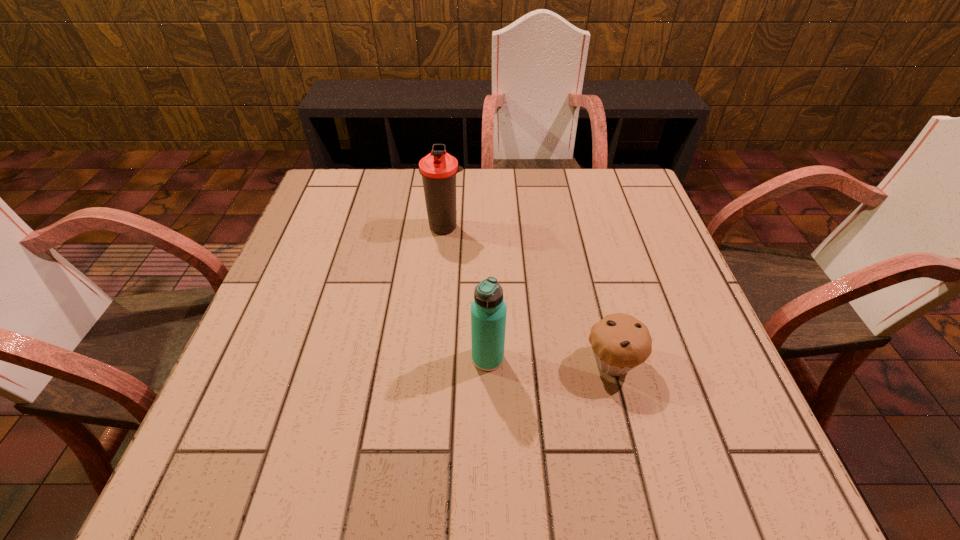
This screenshot has height=540, width=960. I want to click on object located at the right edge, so click(620, 342).

Identify the location of vacant space at the far edge. (529, 192).

Find the location of a particular element. Image resolution: width=960 pixels, height=540 pixels. free region at the near edge of the desktop is located at coordinates (586, 480).

Where is `vacant space at the left edge of the desktop`? This screenshot has width=960, height=540. vacant space at the left edge of the desktop is located at coordinates (312, 374).

Image resolution: width=960 pixels, height=540 pixels. In order to click on vacant area at the right edge of the desktop in this screenshot , I will do `click(638, 274)`.

The height and width of the screenshot is (540, 960). In order to click on vacant space at the far left corner in this screenshot , I will do `click(370, 200)`.

Where is `free space at the far right corner of the desktop`? free space at the far right corner of the desktop is located at coordinates (604, 174).

This screenshot has width=960, height=540. Find the location of `unoccupied area between the left thermos bottle and the rightmost object`. unoccupied area between the left thermos bottle and the rightmost object is located at coordinates (529, 294).

The image size is (960, 540). I want to click on free spot between the farther thermos bottle and the second object from left to right, so click(467, 292).

The image size is (960, 540). What are the coordinates of `empty location between the shortest object and the second object from right to left` in the screenshot? It's located at (550, 360).